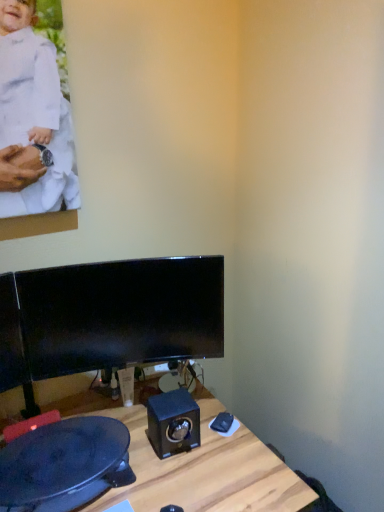
Question: Is black glossy monitor at center smaller than white matte clothing at upper left?

Choices:
 (A) yes
 (B) no

Answer: (B)

Question: From the image's perspective, is black glossy monitor at center under white matte clothing at upper left?

Choices:
 (A) no
 (B) yes

Answer: (B)

Question: Would you consider black glossy monitor at center to be distant from white matte clothing at upper left?

Choices:
 (A) yes
 (B) no

Answer: (B)

Question: Is black glossy monitor at center turned away from white matte clothing at upper left?

Choices:
 (A) yes
 (B) no

Answer: (B)

Question: Does black glossy monitor at center come in front of white matte clothing at upper left?

Choices:
 (A) no
 (B) yes

Answer: (A)

Question: Is black glossy monitor at center aimed at white matte clothing at upper left?

Choices:
 (A) yes
 (B) no

Answer: (B)

Question: Is wooden desk at center further to camera compared to black glossy speaker at center?

Choices:
 (A) no
 (B) yes

Answer: (A)

Question: Is black glossy speaker at center at the back of wooden desk at center?

Choices:
 (A) yes
 (B) no

Answer: (B)

Question: Is wooden desk at center beside black glossy speaker at center?

Choices:
 (A) yes
 (B) no

Answer: (B)

Question: Is wooden desk at center in front of black glossy speaker at center?

Choices:
 (A) yes
 (B) no

Answer: (A)

Question: From the image's perspective, is wooden desk at center over black glossy speaker at center?

Choices:
 (A) yes
 (B) no

Answer: (B)

Question: From a real-world perspective, is wooden desk at center positioned under black glossy speaker at center based on gravity?

Choices:
 (A) yes
 (B) no

Answer: (A)

Question: From a real-world perspective, is wooden desk at center under white matte clothing at upper left?

Choices:
 (A) yes
 (B) no

Answer: (A)